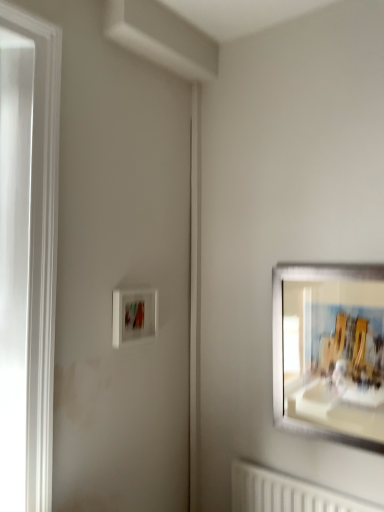
Question: From a real-world perspective, is matte white picture frame at right, the second picture frame viewed from the left, physically above white matte picture frame at center-left, arranged as the 2th picture frame when viewed from the right?

Choices:
 (A) no
 (B) yes

Answer: (A)

Question: Does matte white picture frame at right, acting as the 1th picture frame starting from the right, have a greater height compared to white matte picture frame at center-left, arranged as the 2th picture frame when viewed from the right?

Choices:
 (A) yes
 (B) no

Answer: (A)

Question: Is the position of matte white picture frame at right, the second picture frame viewed from the left, more distant than that of white matte picture frame at center-left, which appears as the first picture frame when viewed from the left?

Choices:
 (A) yes
 (B) no

Answer: (B)

Question: Does matte white picture frame at right, acting as the 1th picture frame starting from the right, have a larger size compared to white matte picture frame at center-left, arranged as the 2th picture frame when viewed from the right?

Choices:
 (A) yes
 (B) no

Answer: (A)

Question: From the image's perspective, is matte white picture frame at right, acting as the 1th picture frame starting from the right, on white matte picture frame at center-left, arranged as the 2th picture frame when viewed from the right?

Choices:
 (A) no
 (B) yes

Answer: (A)

Question: Can you confirm if matte white picture frame at right, acting as the 1th picture frame starting from the right, is smaller than white matte picture frame at center-left, which appears as the first picture frame when viewed from the left?

Choices:
 (A) no
 (B) yes

Answer: (A)

Question: Is white matte picture frame at center-left, which appears as the first picture frame when viewed from the left, to the right of matte white picture frame at right, acting as the 1th picture frame starting from the right, from the viewer's perspective?

Choices:
 (A) yes
 (B) no

Answer: (B)

Question: From a real-world perspective, is white matte picture frame at center-left, arranged as the 2th picture frame when viewed from the right, over matte white picture frame at right, acting as the 1th picture frame starting from the right?

Choices:
 (A) yes
 (B) no

Answer: (A)

Question: Would you say white matte picture frame at center-left, which appears as the first picture frame when viewed from the left, is a long distance from matte white picture frame at right, acting as the 1th picture frame starting from the right?

Choices:
 (A) no
 (B) yes

Answer: (A)

Question: Does white matte picture frame at center-left, arranged as the 2th picture frame when viewed from the right, have a greater width compared to matte white picture frame at right, acting as the 1th picture frame starting from the right?

Choices:
 (A) yes
 (B) no

Answer: (A)

Question: Can you confirm if white matte picture frame at center-left, which appears as the first picture frame when viewed from the left, is bigger than matte white picture frame at right, acting as the 1th picture frame starting from the right?

Choices:
 (A) no
 (B) yes

Answer: (A)

Question: Could matte white picture frame at right, acting as the 1th picture frame starting from the right, be considered to be inside white matte picture frame at center-left, arranged as the 2th picture frame when viewed from the right?

Choices:
 (A) no
 (B) yes

Answer: (A)

Question: From their relative heights in the image, would you say white matte picture frame at center-left, arranged as the 2th picture frame when viewed from the right, is taller or shorter than matte white picture frame at right, the second picture frame viewed from the left?

Choices:
 (A) tall
 (B) short

Answer: (B)